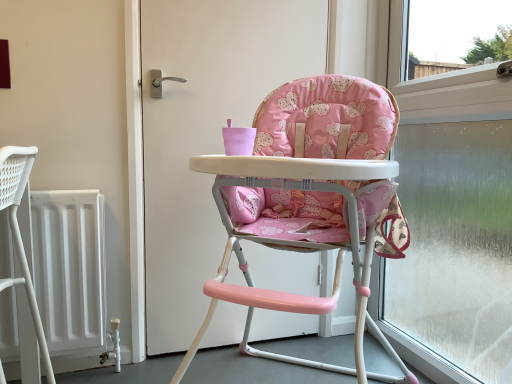
Question: Considering the relative sizes of pink fabric high chair at center and frosted glass window at right in the image provided, is pink fabric high chair at center smaller than frosted glass window at right?

Choices:
 (A) yes
 (B) no

Answer: (A)

Question: Is pink fabric high chair at center wider than frosted glass window at right?

Choices:
 (A) yes
 (B) no

Answer: (B)

Question: Can you confirm if pink fabric high chair at center is taller than frosted glass window at right?

Choices:
 (A) yes
 (B) no

Answer: (B)

Question: Does pink fabric high chair at center appear on the left side of frosted glass window at right?

Choices:
 (A) no
 (B) yes

Answer: (B)

Question: Is the surface of pink fabric high chair at center in direct contact with frosted glass window at right?

Choices:
 (A) yes
 (B) no

Answer: (B)

Question: Is point (266, 61) positioned closer to the camera than point (493, 309)?

Choices:
 (A) closer
 (B) farther

Answer: (A)

Question: From the image's perspective, relative to frosted glass window at right, is pink fabric high chair at center above or below?

Choices:
 (A) above
 (B) below

Answer: (A)

Question: In the image, is pink fabric high chair at center positioned in front of or behind frosted glass window at right?

Choices:
 (A) front
 (B) behind

Answer: (B)

Question: Is pink fabric high chair at center wider or thinner than frosted glass window at right?

Choices:
 (A) thin
 (B) wide

Answer: (A)

Question: Considering the positions of frosted glass window at right and pink fabric highchair at center in the image, is frosted glass window at right taller or shorter than pink fabric highchair at center?

Choices:
 (A) tall
 (B) short

Answer: (A)

Question: Is frosted glass window at right to the left or to the right of pink fabric highchair at center in the image?

Choices:
 (A) right
 (B) left

Answer: (A)

Question: From a real-world perspective, is frosted glass window at right above or below pink fabric highchair at center?

Choices:
 (A) below
 (B) above

Answer: (B)

Question: Is frosted glass window at right in front of or behind pink fabric highchair at center in the image?

Choices:
 (A) front
 (B) behind

Answer: (B)

Question: In terms of size, does frosted glass window at right appear bigger or smaller than pink fabric high chair at center?

Choices:
 (A) small
 (B) big

Answer: (B)

Question: Is point (448, 377) positioned closer to the camera than point (279, 319)?

Choices:
 (A) farther
 (B) closer

Answer: (B)